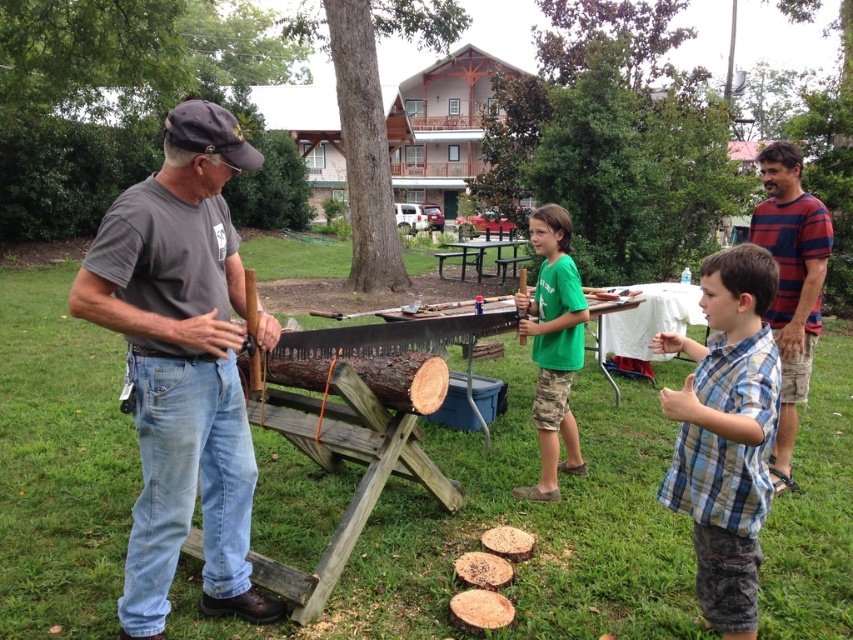
Question: Does green cotton shirt at center appear on the left side of black plastic picnic table at center?

Choices:
 (A) no
 (B) yes

Answer: (B)

Question: Which point is farther from the camera taking this photo?

Choices:
 (A) (817, 227)
 (B) (546, 301)

Answer: (A)

Question: Does gray cotton t-shirt at left have a greater width compared to blue plaid shirt at center?

Choices:
 (A) no
 (B) yes

Answer: (B)

Question: Which of the following is the closest to the observer?

Choices:
 (A) (471, 240)
 (B) (785, 275)

Answer: (B)

Question: Which point is closer to the camera?

Choices:
 (A) (544, 212)
 (B) (169, 480)

Answer: (B)

Question: Does gray cotton t-shirt at left have a larger size compared to blue striped shirt at upper right?

Choices:
 (A) no
 (B) yes

Answer: (A)